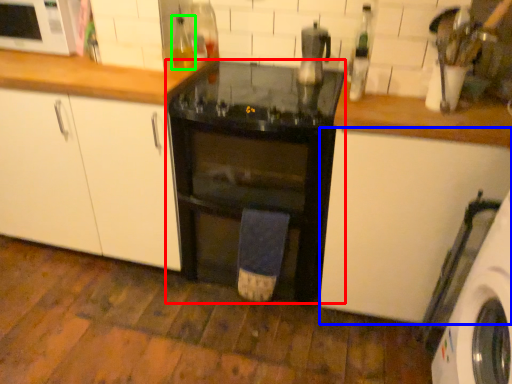
Question: Estimate the real-world distances between objects in this image. Which object is farther from home appliance (highlighted by a red box), cabinetry (highlighted by a blue box) or bottle (highlighted by a green box)?

Choices:
 (A) cabinetry
 (B) bottle

Answer: (B)